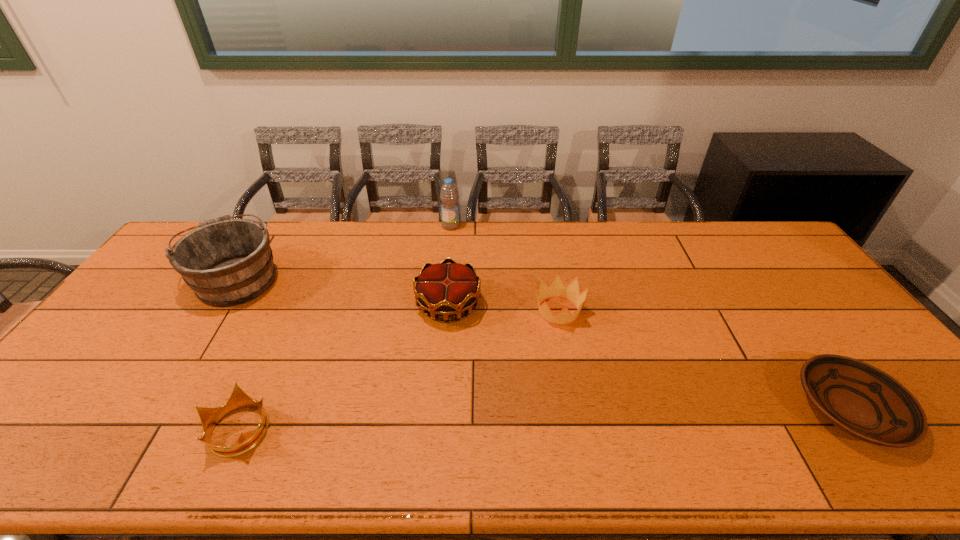
Where is `water bottle`? The width and height of the screenshot is (960, 540). water bottle is located at coordinates (449, 195).

Find the location of a particular element. Image resolution: width=960 pixels, height=540 pixels. wine bucket is located at coordinates (226, 262).

Locate an element on the screen. the second crown from right to left is located at coordinates (x=442, y=289).

Where is `the second object from right to left`? The width and height of the screenshot is (960, 540). the second object from right to left is located at coordinates tap(557, 289).

The image size is (960, 540). I want to click on the leftmost crown, so click(x=209, y=417).

At what (x,y) coordinates should I click in order to perform the action: click on the second object from left to right. Please return your answer as a coordinate pair (x, y). The height and width of the screenshot is (540, 960). Looking at the image, I should click on (209, 417).

Where is `plate`? Image resolution: width=960 pixels, height=540 pixels. plate is located at coordinates (860, 399).

The image size is (960, 540). In order to click on the rightmost object in this screenshot , I will do `click(860, 399)`.

You are a GUI agent. You are given a task and a screenshot of the screen. Output one action in this format:
    pyautogui.click(x=<x>, y=<y>)
    Task: Click on the vacant space located on the right of the water bottle
    The width and height of the screenshot is (960, 540).
    Given the screenshot: What is the action you would take?
    tap(546, 226)

At what (x,y) coordinates should I click in order to perform the action: click on free space located on the right of the leftmost object. Please return your answer as a coordinate pair (x, y). Looking at the image, I should click on (348, 279).